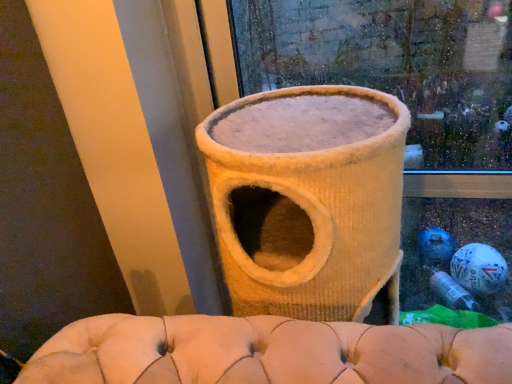
What do you see at coordinates (308, 199) in the screenshot? I see `beige tufted bean bag chair at center` at bounding box center [308, 199].

At what (x,y) coordinates should I click in order to perform the action: click on beige tufted bean bag chair at center. Please return your answer as a coordinate pair (x, y). The image size is (512, 384). Looking at the image, I should click on (308, 199).

Measure the distance between point (390, 101) and camera.

Point (390, 101) is 30.55 inches away from camera.

This screenshot has width=512, height=384. I want to click on beige tufted bean bag chair at center, so click(308, 199).